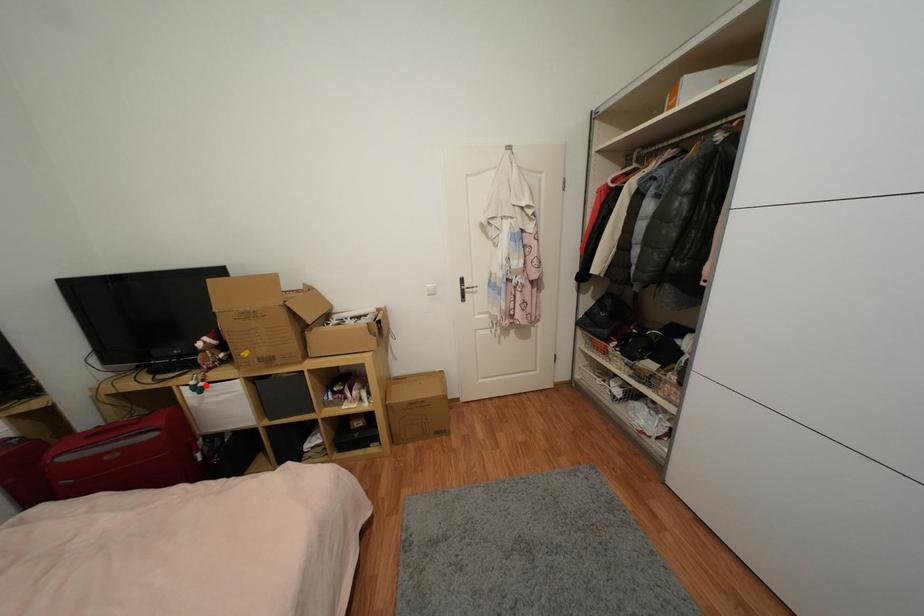
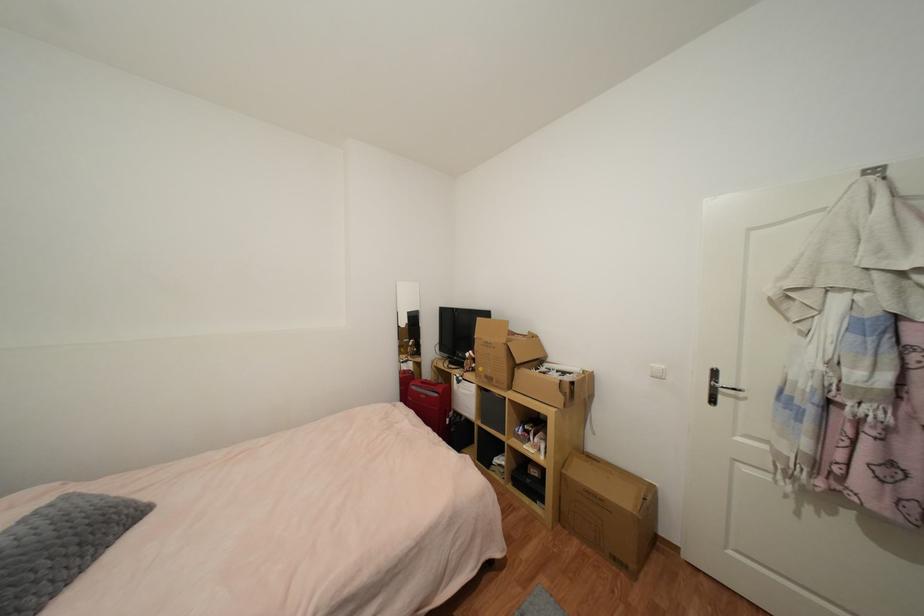
Locate, in the second image, the point that corresponds to the highlighted location in the first image.

(465, 379)